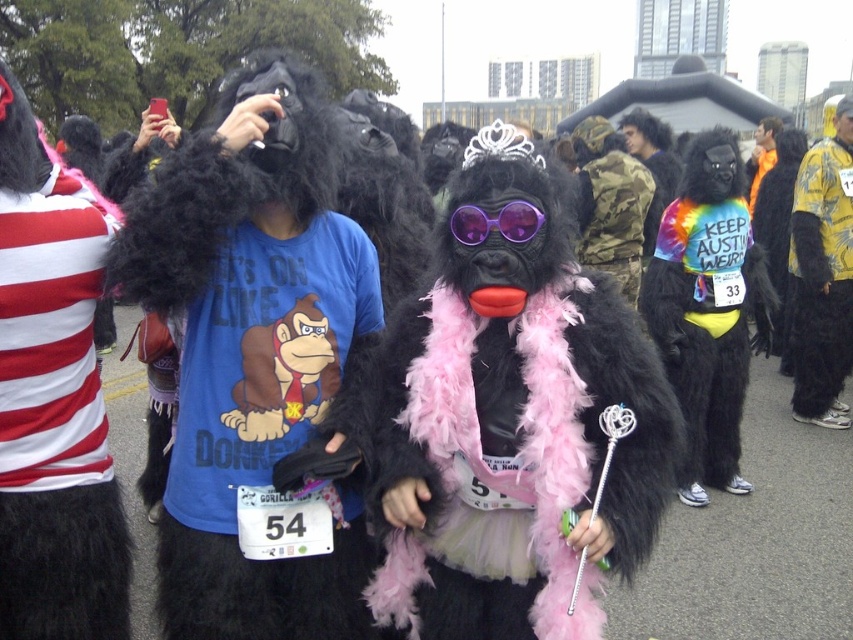
You are a photographer trying to capture both the yellow printed shirt at right and the purple plastic goggles at center in a single shot. Which object should you focus on first to ensure both are in frame?

The yellow printed shirt at right is much taller than the purple plastic goggles at center, so you should focus on the yellow printed shirt at right first to ensure both are in frame.